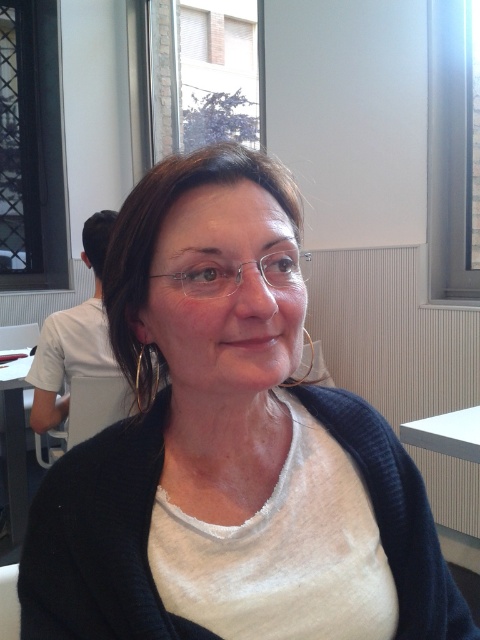
Question: Is metallic mesh window at upper left wider than matte glass window at upper center?

Choices:
 (A) yes
 (B) no

Answer: (B)

Question: Based on their relative distances, which object is farther from the clear plastic glasses at center?

Choices:
 (A) matte black cardigan at center
 (B) white glossy table at lower left
 (C) metallic mesh window at upper left
 (D) white glass window at upper right

Answer: (C)

Question: Which object is closer to the camera taking this photo?

Choices:
 (A) matte black cardigan at center
 (B) white glass window at upper right
 (C) clear plastic glasses at center
 (D) white glossy table at lower left

Answer: (A)

Question: Does metallic mesh window at upper left appear on the left side of white glossy table at lower left?

Choices:
 (A) yes
 (B) no

Answer: (A)

Question: Which point is farther to the camera?

Choices:
 (A) matte black cardigan at center
 (B) white glass window at upper right
 (C) white glossy table at lower left
 (D) clear plastic glasses at center

Answer: (B)

Question: Can you confirm if white glossy table at lower left is bigger than clear plastic glasses at center?

Choices:
 (A) no
 (B) yes

Answer: (B)